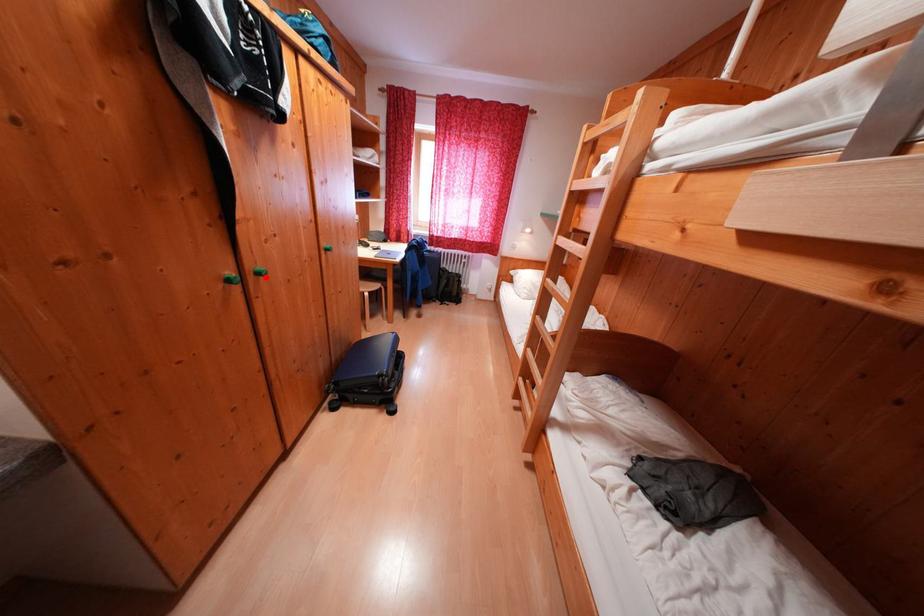
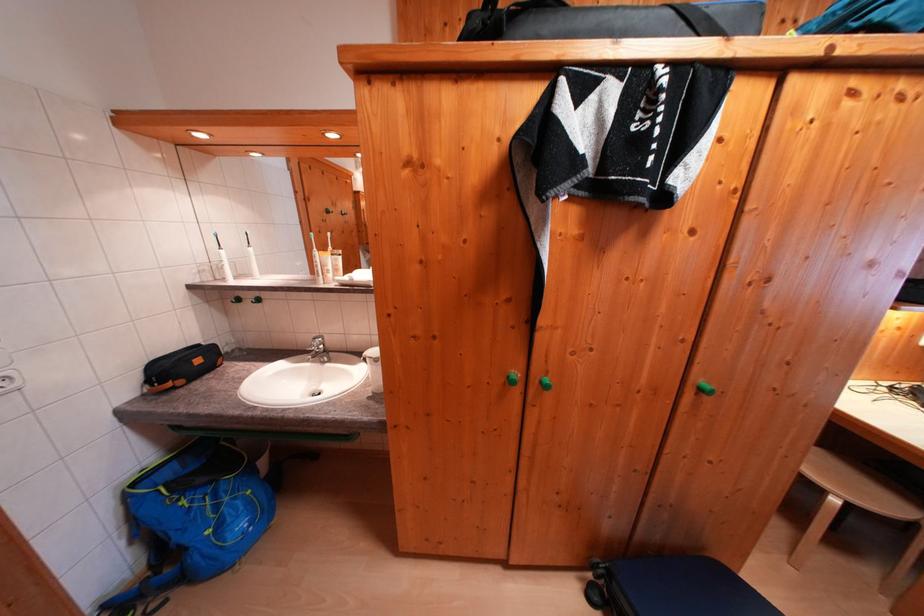
Question: I am providing you with two images of the same scene from different viewpoints. A red point is marked on the first image. Is the red point's position out of view in image 2?

Choices:
 (A) Yes
 (B) No

Answer: (B)